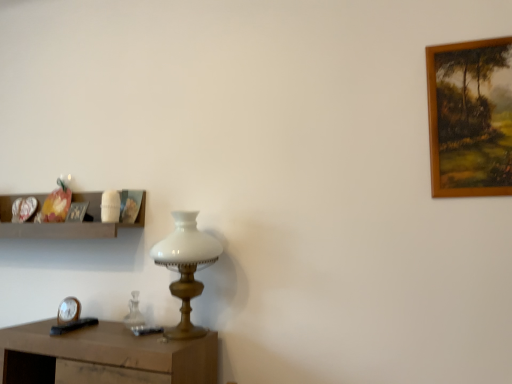
Question: Is wooden shelf at left inside or outside of white glass table lamp at center?

Choices:
 (A) inside
 (B) outside

Answer: (B)

Question: Is point (77, 226) closer or farther from the camera than point (186, 329)?

Choices:
 (A) farther
 (B) closer

Answer: (A)

Question: Estimate the real-world distances between objects in this image. Which object is closer to the metallic silver clock at lower left?

Choices:
 (A) wooden picture frame at upper left, the first picture frame viewed from the back
 (B) white glass table lamp at center
 (C) wooden shelf at left
 (D) brown wooden picture frame at upper right, the 2th picture frame from the bottom

Answer: (A)

Question: Estimate the real-world distances between objects in this image. Which object is farther from the wooden shelf at left?

Choices:
 (A) metallic silver clock at lower left
 (B) wooden picture frame at upper left, which is the 1th picture frame from left to right
 (C) brown wooden picture frame at upper right, the 2th picture frame from the bottom
 (D) white glass table lamp at center

Answer: (C)